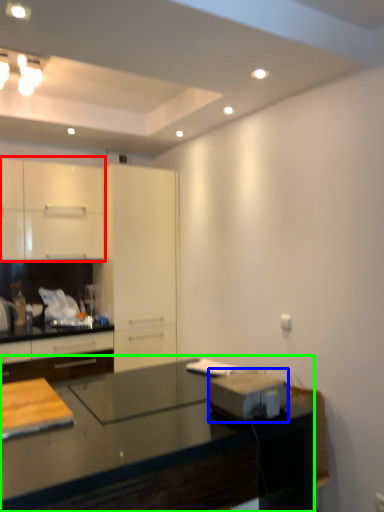
Question: Which object is the closest to the cabinetry (highlighted by a red box)? Choose among these: appliance (highlighted by a blue box) or countertop (highlighted by a green box).

Choices:
 (A) appliance
 (B) countertop

Answer: (B)